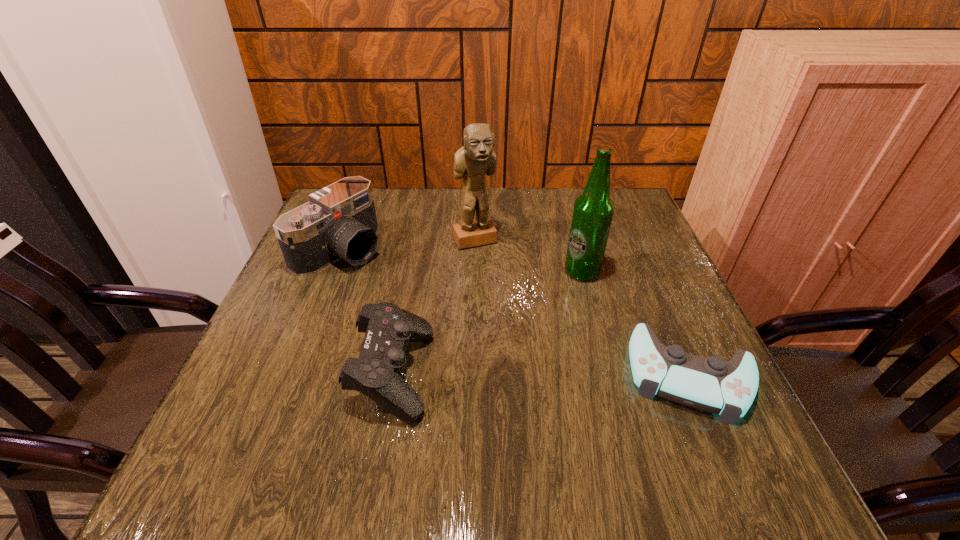
The width and height of the screenshot is (960, 540). Find the location of `vacant area situated 0.080m on the front-facing side of the third tallest object`. vacant area situated 0.080m on the front-facing side of the third tallest object is located at coordinates (393, 280).

The width and height of the screenshot is (960, 540). What are the coordinates of `free space located on the front-facing side of the third tallest object` in the screenshot? It's located at (411, 291).

Identify the location of vacant space situated 0.280m on the front-facing side of the third tallest object. (457, 318).

At what (x,y) coordinates should I click in order to perform the action: click on free space located 0.400m on the front-facing side of the third object from left to right. Please return your answer as a coordinate pair (x, y). Image resolution: width=960 pixels, height=540 pixels. Looking at the image, I should click on (552, 371).

Where is `vacant position located 0.340m on the front-facing side of the third object from left to right`? Image resolution: width=960 pixels, height=540 pixels. vacant position located 0.340m on the front-facing side of the third object from left to right is located at coordinates (x=540, y=348).

Where is `free region located on the front-facing side of the third object from left to right`? This screenshot has height=540, width=960. free region located on the front-facing side of the third object from left to right is located at coordinates (533, 337).

Where is `vacant position located 0.100m on the label of the beer bottle`? This screenshot has width=960, height=540. vacant position located 0.100m on the label of the beer bottle is located at coordinates (576, 313).

You are a GUI agent. You are given a task and a screenshot of the screen. Output one action in this format:
    pyautogui.click(x=<x>, y=<y>)
    Task: Click on the free region located 0.380m on the label of the beer bottle
    
    Given the screenshot: What is the action you would take?
    pyautogui.click(x=561, y=427)

Find the location of a particular element. This screenshot has width=960, height=540. blank area located 0.300m on the label of the beer bottle is located at coordinates (565, 388).

The height and width of the screenshot is (540, 960). What are the coordinates of `camera that is at the far edge` in the screenshot? It's located at 339,222.